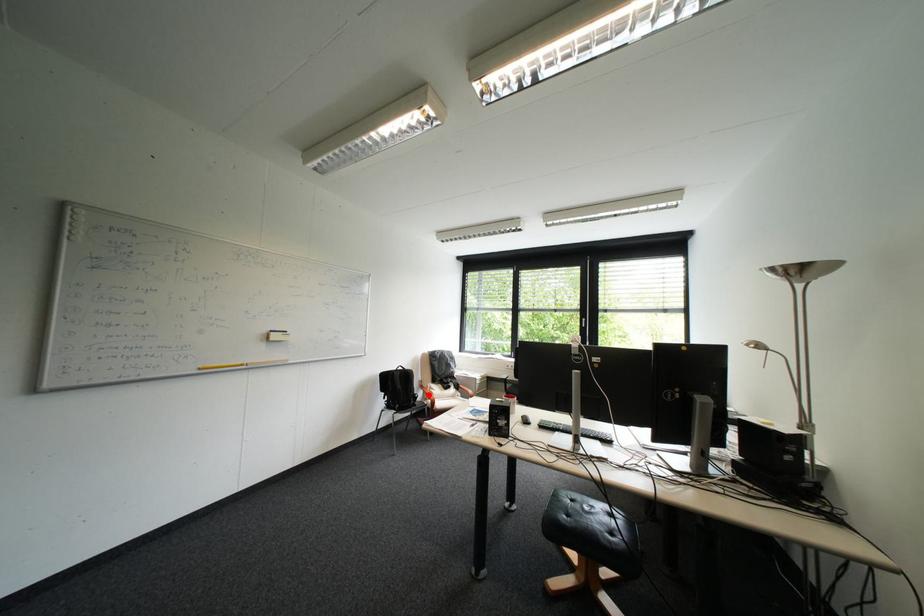
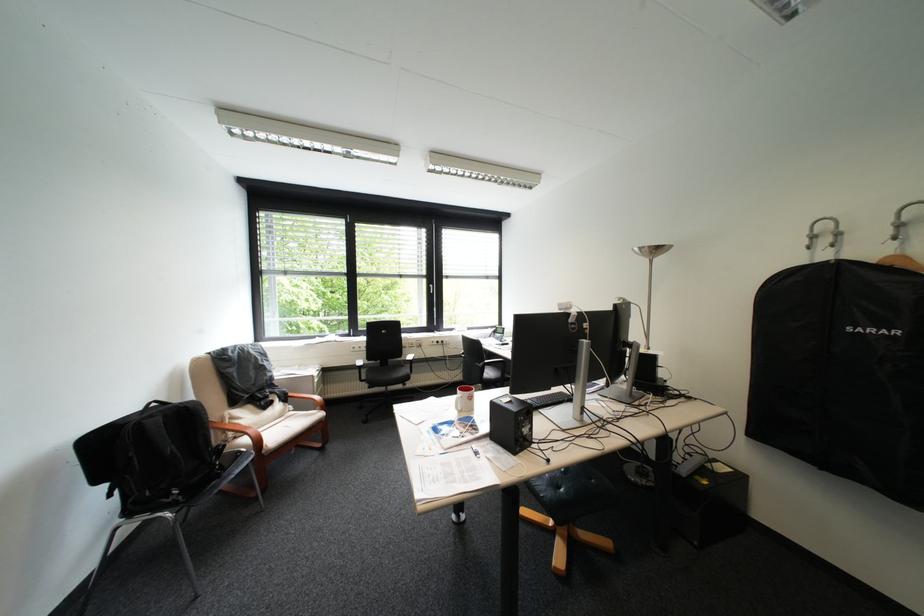
Question: A red point is marked in image1. In image2, is the corresponding 3D point closer to the camera or farther? Reply with the corresponding letter.

Choices:
 (A) The corresponding 3D point is closer.
 (B) The corresponding 3D point is farther.

Answer: (A)